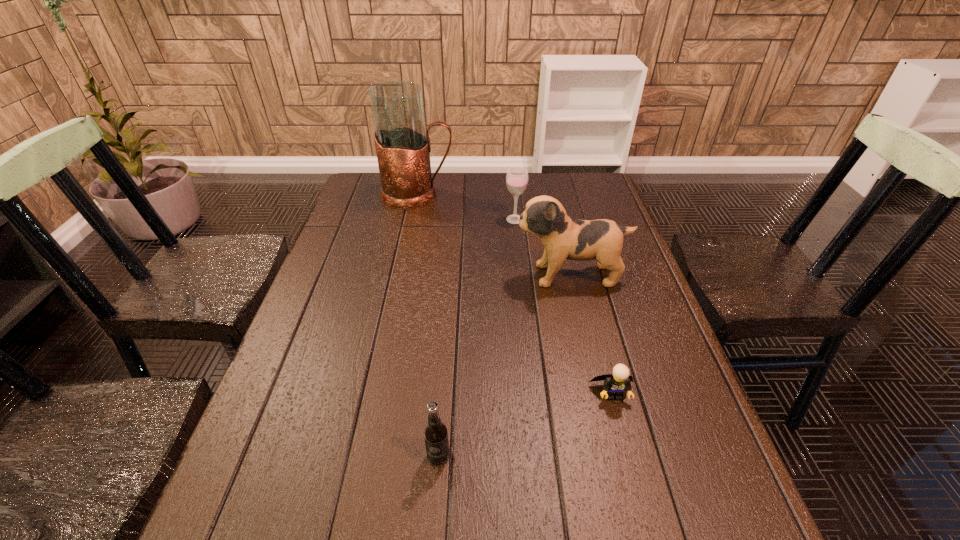
Find the location of a particular element. The height and width of the screenshot is (540, 960). empty location between the tallest object and the third farthest object is located at coordinates (493, 235).

The height and width of the screenshot is (540, 960). I want to click on vacant area that lies between the nearest object and the wineglass, so click(x=477, y=338).

At what (x,y) coordinates should I click in order to perform the action: click on vacant space that is in between the wineglass and the second tallest object. Please return your answer as a coordinate pair (x, y). Looking at the image, I should click on (542, 247).

Where is `free spot between the tallest object and the puppy`? The width and height of the screenshot is (960, 540). free spot between the tallest object and the puppy is located at coordinates (493, 235).

This screenshot has width=960, height=540. Find the location of `vacant region between the pitcher and the nearest object`. vacant region between the pitcher and the nearest object is located at coordinates (x=428, y=326).

Locate an element on the screen. The width and height of the screenshot is (960, 540). empty space between the third nearest object and the wineglass is located at coordinates (542, 247).

Select which object appears as the closest to the pitcher. Please provide its 2D coordinates. Your answer should be formatted as a tuple, i.e. [(x, y)], where the tuple contains the x and y coordinates of a point satisfying the conditions above.

[(517, 177)]

Where is `the closest object relative to the wineglass`? This screenshot has height=540, width=960. the closest object relative to the wineglass is located at coordinates (403, 147).

The image size is (960, 540). Find the location of `free spot that satisfies the following two spatial constraints: 1. on the back side of the wineglass; 2. with the handle on the side of the farthest object`. free spot that satisfies the following two spatial constraints: 1. on the back side of the wineglass; 2. with the handle on the side of the farthest object is located at coordinates (513, 195).